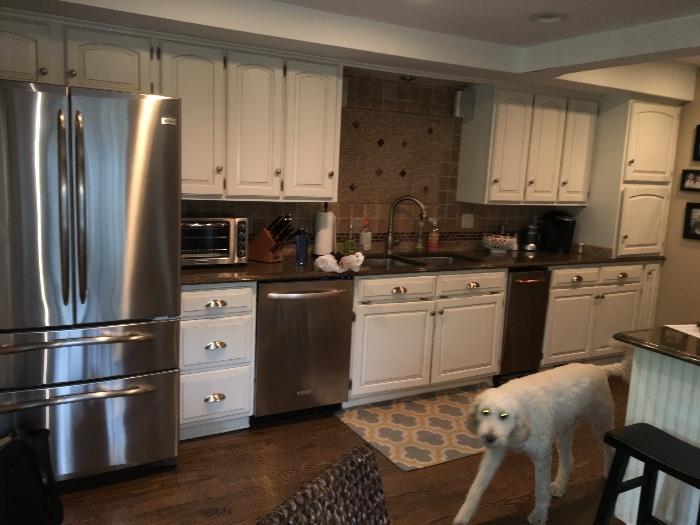
Identify the location of recessed light. This screenshot has width=700, height=525. point(549,18).